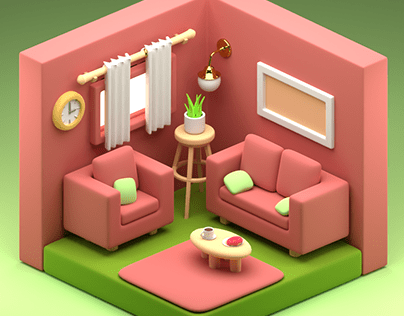
This screenshot has width=404, height=316. In order to click on plant in this screenshot , I will do `click(198, 123)`.